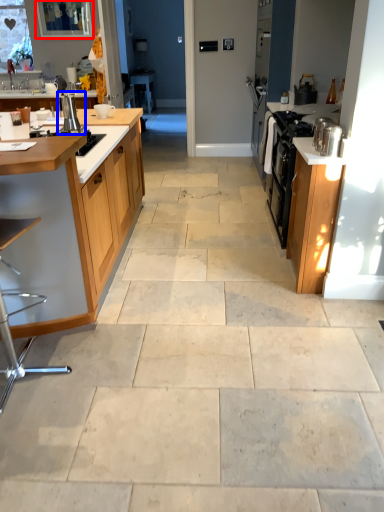
Question: Among these objects, which one is farthest to the camera, window screen (highlighted by a red box) or appliance (highlighted by a blue box)?

Choices:
 (A) window screen
 (B) appliance

Answer: (A)